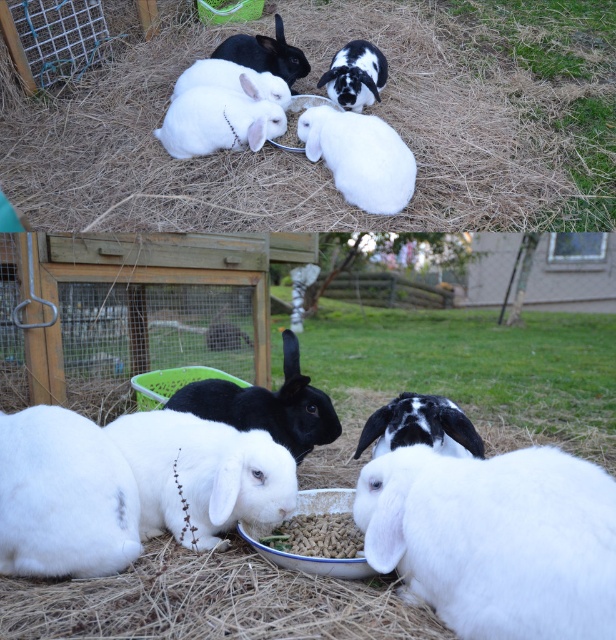
You are a photographer who wants to capture a closeup of the white fluffy rabbit at lower right without the black soft fur rabbit at upper center blocking the view. Based on their positions, is this possible?

The white fluffy rabbit at lower right is positioned under the black soft fur rabbit at upper center, so the black soft fur rabbit at upper center is blocking the view. Therefore, it is not possible to capture a clear closeup of the white fluffy rabbit at lower right without the black soft fur rabbit at upper center blocking the view.

What is the color of the rabbit located at the coordinates point (419, 426)?

The rabbit at point (419, 426) is a black matte rabbit at center.

Based on the photo, you are a photographer who wants to capture the white fluffy rabbit at lower right in the bottom photograph. Based on the coordinates provided, where should you focus your camera?

The white fluffy rabbit at lower right is located at coordinates point (495, 540), so you should focus your camera there to capture it.